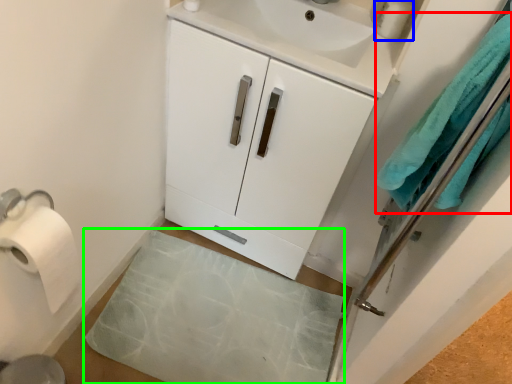
Question: Which is farther away from bath towel (highlighted by a red box)? toiletry (highlighted by a blue box) or bath mat (highlighted by a green box)?

Choices:
 (A) toiletry
 (B) bath mat

Answer: (B)